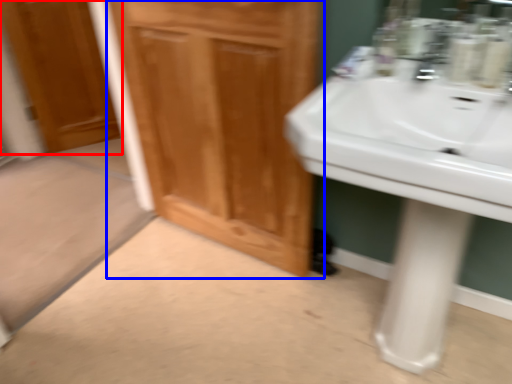
Question: Which of the following is the farthest to the observer, door (highlighted by a red box) or bathroom cabinet (highlighted by a blue box)?

Choices:
 (A) door
 (B) bathroom cabinet

Answer: (A)